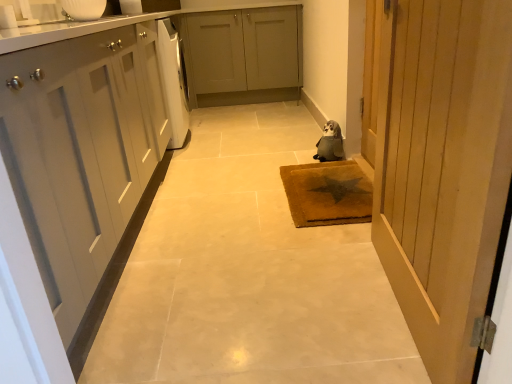
Identify the location of white glossy dishwasher at left. The width and height of the screenshot is (512, 384). (173, 81).

Measure the distance between wooden door at right and camera.

wooden door at right and camera are 64.48 centimeters apart from each other.

Identify the location of brown textured mat at center. tap(327, 193).

Can you tell me how much wooden door at right and gray plush toy at center differ in facing direction?

The angle between the facing direction of wooden door at right and the facing direction of gray plush toy at center is 24.7 degrees.

Which of these two, wooden door at right or gray plush toy at center, is bigger?

wooden door at right is bigger.

Where is `door on the left of gray plush toy at center`? door on the left of gray plush toy at center is located at coordinates (442, 166).

From the image's perspective, is white matte cabinet at left, the 2th cabinetry from the back, positioned above or below wooden door at right?

white matte cabinet at left, the 2th cabinetry from the back, is situated higher than wooden door at right in the image.

Is white matte cabinet at left, arranged as the first cabinetry when ordered from the bottom, far away from wooden door at right?

They are positioned close to each other.

Can we say white matte cabinet at left, arranged as the 2th cabinetry when viewed from the top, lies outside wooden door at right?

That's correct, white matte cabinet at left, arranged as the 2th cabinetry when viewed from the top, is outside of wooden door at right.

Considering the positions of objects white matte cabinet at left, marked as the 1th cabinetry in a front-to-back arrangement, and wooden door at right in the image provided, who is more to the left, white matte cabinet at left, marked as the 1th cabinetry in a front-to-back arrangement, or wooden door at right?

Positioned to the left is white matte cabinet at left, marked as the 1th cabinetry in a front-to-back arrangement.

Considering the positions of points (242, 15) and (468, 382), is point (242, 15) farther from camera compared to point (468, 382)?

Yes, point (242, 15) is behind point (468, 382).

Is matte gray cabinets at center, which appears as the 2th cabinetry when viewed from the front, next to wooden door at right?

matte gray cabinets at center, which appears as the 2th cabinetry when viewed from the front, and wooden door at right are not in contact.

From a real-world perspective, is matte gray cabinets at center, the 2th cabinetry ordered from the bottom, positioned above or below wooden door at right?

Clearly, from a real-world perspective, matte gray cabinets at center, the 2th cabinetry ordered from the bottom, is below wooden door at right.

In the image, is matte gray cabinets at center, which appears as the 2th cabinetry when viewed from the front, on the left side or the right side of wooden door at right?

matte gray cabinets at center, which appears as the 2th cabinetry when viewed from the front, is positioned on wooden door at right's left side.

Relative to white glossy dishwasher at left, is wooden door at right in front or behind?

wooden door at right is positioned closer to the viewer than white glossy dishwasher at left.

Is white glossy dishwasher at left at the back of wooden door at right?

No.

Considering the relative positions of white matte cabinet at left, marked as the 1th cabinetry in a front-to-back arrangement, and brown textured mat at center in the image provided, is white matte cabinet at left, marked as the 1th cabinetry in a front-to-back arrangement, to the right of brown textured mat at center from the viewer's perspective?

Incorrect, white matte cabinet at left, marked as the 1th cabinetry in a front-to-back arrangement, is not on the right side of brown textured mat at center.

Would you consider white matte cabinet at left, arranged as the 2th cabinetry when viewed from the top, to be distant from brown textured mat at center?

No, white matte cabinet at left, arranged as the 2th cabinetry when viewed from the top, is not far from brown textured mat at center.

In the scene shown: Considering the sizes of objects brown textured mat at center and white glossy dishwasher at left in the image provided, who is thinner, brown textured mat at center or white glossy dishwasher at left?

white glossy dishwasher at left.

Consider the image. Which is more to the right, brown textured mat at center or white glossy dishwasher at left?

From the viewer's perspective, brown textured mat at center appears more on the right side.

Considering the relative positions of brown textured mat at center and white glossy dishwasher at left in the image provided, is brown textured mat at center behind white glossy dishwasher at left?

No, it is not.

Is brown textured mat at center taller or shorter than white glossy dishwasher at left?

Considering their sizes, brown textured mat at center has less height than white glossy dishwasher at left.

From a real-world perspective, which is physically above, gray plush toy at center or wooden door at right?

From a 3D spatial view, wooden door at right is above.

Is wooden door at right at the back of gray plush toy at center?

No, wooden door at right is not at the back of gray plush toy at center.

Is gray plush toy at center smaller than wooden door at right?

Yes, gray plush toy at center is smaller than wooden door at right.

From the image's perspective, who appears lower, gray plush toy at center or wooden door at right?

wooden door at right.

The width and height of the screenshot is (512, 384). Identify the location of door in front of the gray plush toy at center. (442, 166).

Identify the location of the 1st cabinetry behind the wooden door at right, starting your count from the anchor. (80, 153).

Looking at the image, which one is located further to white matte cabinet at left, the 2th cabinetry from the back, matte gray cabinets at center, which appears as the 2th cabinetry when viewed from the front, or brown textured mat at center?

Based on the image, matte gray cabinets at center, which appears as the 2th cabinetry when viewed from the front, appears to be further to white matte cabinet at left, the 2th cabinetry from the back.

Consider the image. Based on their spatial positions, is wooden door at right or matte gray cabinets at center, the 2th cabinetry ordered from the bottom, closer to gray plush toy at center?

wooden door at right lies closer to gray plush toy at center than the other object.

When comparing their distances from white matte cabinet at left, marked as the 1th cabinetry in a front-to-back arrangement, does brown textured mat at center or gray plush toy at center seem further?

Among the two, gray plush toy at center is located further to white matte cabinet at left, marked as the 1th cabinetry in a front-to-back arrangement.

When comparing their distances from wooden door at right, does matte gray cabinets at center, the 2th cabinetry ordered from the bottom, or white glossy dishwasher at left seem closer?

white glossy dishwasher at left lies closer to wooden door at right than the other object.

Which object lies nearer to the anchor point white glossy dishwasher at left, gray plush toy at center or wooden door at right?

Based on the image, gray plush toy at center appears to be nearer to white glossy dishwasher at left.

Looking at the image, which one is located closer to white matte cabinet at left, marked as the 1th cabinetry in a front-to-back arrangement, gray plush toy at center or white glossy dishwasher at left?

Among the two, white glossy dishwasher at left is located nearer to white matte cabinet at left, marked as the 1th cabinetry in a front-to-back arrangement.

From the image, which object appears to be nearer to brown textured mat at center, matte gray cabinets at center, the 2th cabinetry ordered from the bottom, or white matte cabinet at left, marked as the 1th cabinetry in a front-to-back arrangement?

The object closer to brown textured mat at center is white matte cabinet at left, marked as the 1th cabinetry in a front-to-back arrangement.

Looking at the image, which one is located closer to white matte cabinet at left, marked as the 1th cabinetry in a front-to-back arrangement, wooden door at right or white glossy dishwasher at left?

wooden door at right is closer to white matte cabinet at left, marked as the 1th cabinetry in a front-to-back arrangement.

Image resolution: width=512 pixels, height=384 pixels. I want to click on mat between white glossy dishwasher at left and gray plush toy at center from left to right, so click(x=327, y=193).

At what (x,y) coordinates should I click in order to perform the action: click on mat positioned between wooden door at right and matte gray cabinets at center, which appears as the 2th cabinetry when viewed from the front, from near to far. Please return your answer as a coordinate pair (x, y). The image size is (512, 384). Looking at the image, I should click on (327, 193).

This screenshot has height=384, width=512. I want to click on cabinetry between wooden door at right and brown textured mat at center from front to back, so tap(80, 153).

Identify the location of dish washer positioned between white matte cabinet at left, arranged as the first cabinetry when ordered from the bottom, and matte gray cabinets at center, which appears as the 2th cabinetry when viewed from the front, from near to far. (173, 81).